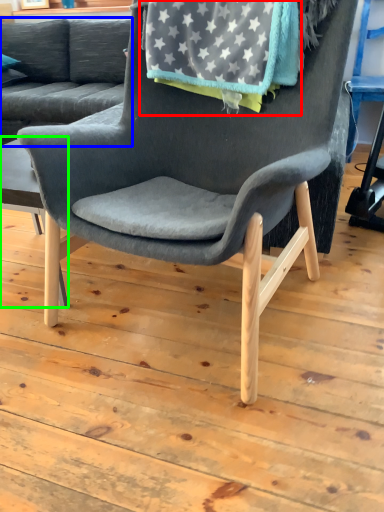
Question: Which object is the closest to the blanket (highlighted by a red box)? Choose among these: studio couch (highlighted by a blue box) or table (highlighted by a green box).

Choices:
 (A) studio couch
 (B) table

Answer: (B)